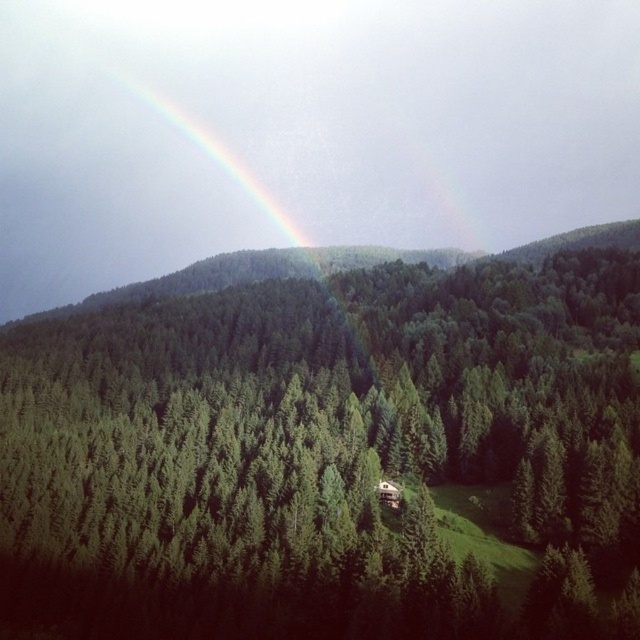
Which is in front, point (234, 588) or point (186, 120)?

Positioned in front is point (234, 588).

In the scene shown: Between green matte tree at center and rainbow at upper center, which one is positioned lower?

Result: green matte tree at center is lower down.

Between point (134, 433) and point (284, 241), which one is positioned in front?

Point (134, 433)

This screenshot has height=640, width=640. I want to click on green matte tree at center, so click(326, 451).